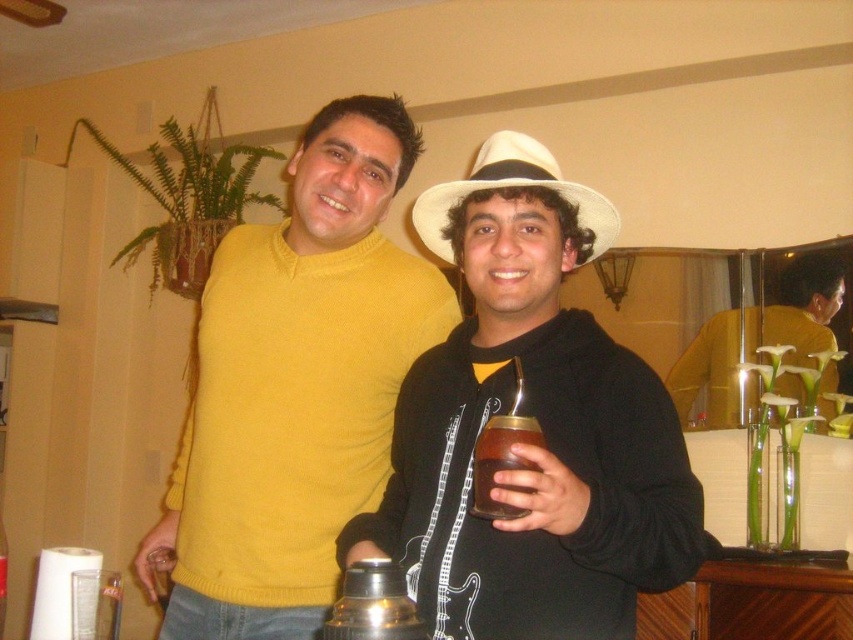
Question: Which object is positioned closest to the yellow sweater at center?

Choices:
 (A) white matte hat at center
 (B) brushed metal thermos at lower center
 (C) matte yellow sweater at center
 (D) white felt hat at center

Answer: (C)

Question: Considering the real-world distances, which object is farthest from the matte yellow sweater at center?

Choices:
 (A) yellow sweater at center
 (B) white matte hat at center
 (C) white felt hat at center
 (D) brown matte glass at center

Answer: (A)

Question: Which point is farther to the camera?

Choices:
 (A) (479, 483)
 (B) (601, 209)
 (C) (326, 618)
 (D) (718, 339)

Answer: (D)

Question: Is white felt hat at center further to the viewer compared to brown matte glass at center?

Choices:
 (A) yes
 (B) no

Answer: (A)

Question: Is white matte hat at center in front of brushed metal thermos at lower center?

Choices:
 (A) yes
 (B) no

Answer: (B)

Question: Can you confirm if white matte hat at center is thinner than white felt hat at center?

Choices:
 (A) no
 (B) yes

Answer: (A)